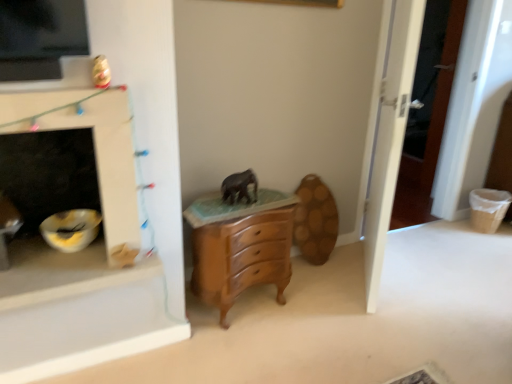
I want to click on blank space situated above white glossy fireplace at left (from a real-world perspective), so click(59, 80).